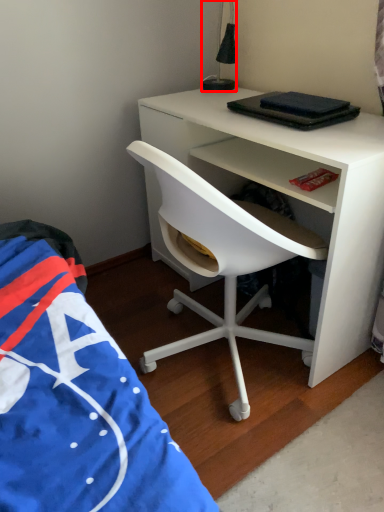
Question: Considering the relative positions of lamp (annotated by the red box) and chair in the image provided, where is lamp (annotated by the red box) located with respect to the staircase?

Choices:
 (A) right
 (B) left

Answer: (B)